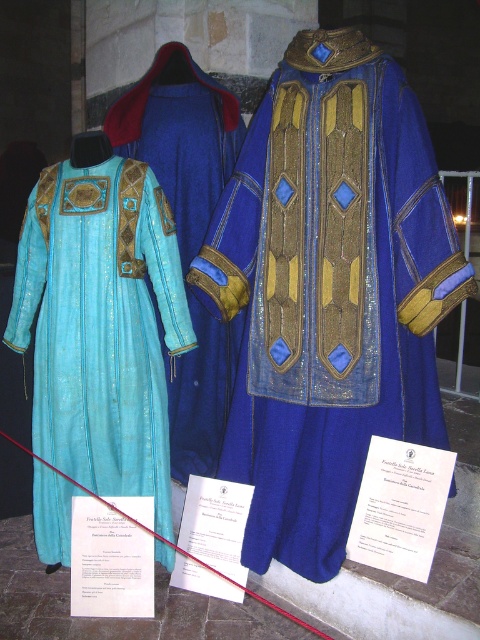
You are a museum visitor standing in front of the blue velvet robe at center. You want to take a photo of it without getting too close. If your camera has a maximum focus range of 2 meters, will you be able to capture a clear photo from your current position?

The blue velvet robe at center is 1.92 meters away from the viewer. Since the camera can focus up to 2 meters, you can take a clear photo without moving closer.

You are a museum visitor standing in front of the three displayed robes. You notice the blue velvet robe at center and the turquoise velvet robe at center. Which one is positioned lower in the display?

The blue velvet robe at center is positioned lower than the turquoise velvet robe at center in the display.

You are a museum visitor standing in front of the display. You see the blue velvet robe at center and the turquoise velvet robe at center. Which robe is positioned to the right of the other?

The blue velvet robe at center is positioned to the right of the turquoise velvet robe at center.